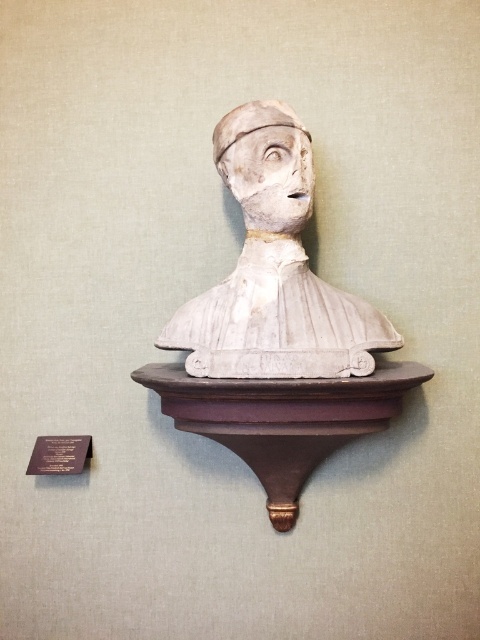
Who is more forward, (334, 387) or (266, 204)?

Positioned in front is point (334, 387).

Is point (277, 470) positioned after point (261, 109)?

Yes.

Who is more forward, (363, 412) or (305, 220)?

Point (363, 412) is in front.

The image size is (480, 640). Find the location of `brown polished wood at center`. brown polished wood at center is located at coordinates (282, 419).

Between brown polished wood at center and matte brown plaque at lower left, which one has more height?

With more height is brown polished wood at center.

Locate an element on the screen. This screenshot has width=480, height=640. brown polished wood at center is located at coordinates (282, 419).

Image resolution: width=480 pixels, height=640 pixels. In order to click on brown polished wood at center in this screenshot , I will do `click(282, 419)`.

Who is positioned more to the left, white clay bust at center or matte brown plaque at lower left?

matte brown plaque at lower left is more to the left.

Between white clay bust at center and matte brown plaque at lower left, which one is positioned higher?

white clay bust at center is higher up.

The height and width of the screenshot is (640, 480). What do you see at coordinates (266, 164) in the screenshot?
I see `white clay bust at center` at bounding box center [266, 164].

At what (x,y) coordinates should I click in order to perform the action: click on white clay bust at center. Please return your answer as a coordinate pair (x, y). Looking at the image, I should click on (266, 164).